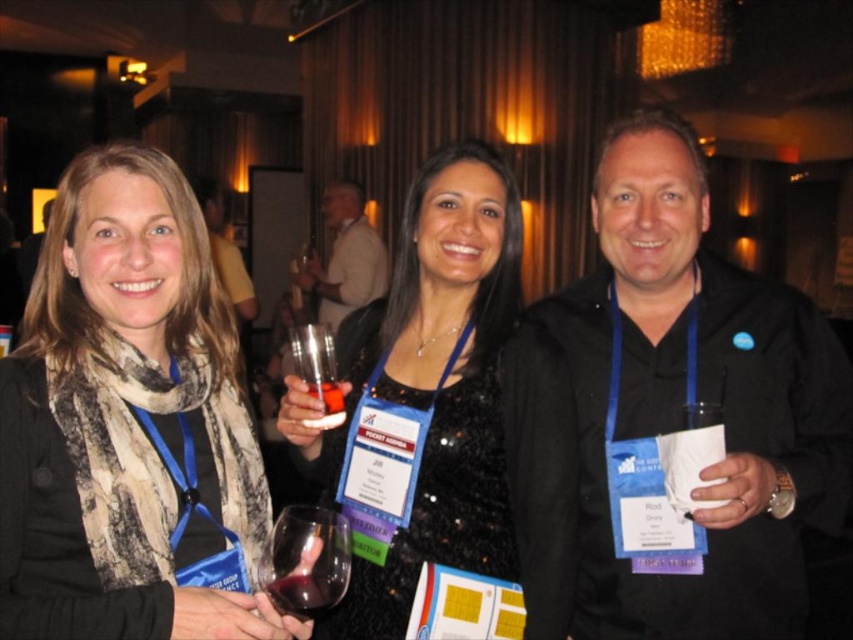
Which is more to the left, white fabric shirt at center or translucent glass at center?

Positioned to the left is white fabric shirt at center.

Can you confirm if white fabric shirt at center is bigger than translucent glass at center?

Correct, white fabric shirt at center is larger in size than translucent glass at center.

Who is more forward, (343, 256) or (335, 412)?

Point (335, 412)

The image size is (853, 640). Find the location of `white fabric shirt at center`. white fabric shirt at center is located at coordinates (345, 257).

Is black matte shirt at center further to the viewer compared to dark red glass at center?

Yes, it is behind dark red glass at center.

Can you confirm if black matte shirt at center is smaller than dark red glass at center?

No, black matte shirt at center is not smaller than dark red glass at center.

Is point (624, 628) farther from viewer compared to point (299, 604)?

Yes, it is.

Image resolution: width=853 pixels, height=640 pixels. In order to click on black matte shirt at center in this screenshot , I will do `click(695, 401)`.

In the scene shown: Who is taller, transparent plastic wine glass at center or dark red glass at center?

transparent plastic wine glass at center is taller.

Between point (311, 326) and point (296, 586), which one is positioned behind?

The point (311, 326) is behind.

Describe the element at coordinates (317, 371) in the screenshot. I see `transparent plastic wine glass at center` at that location.

Image resolution: width=853 pixels, height=640 pixels. I want to click on transparent plastic wine glass at center, so click(x=317, y=371).